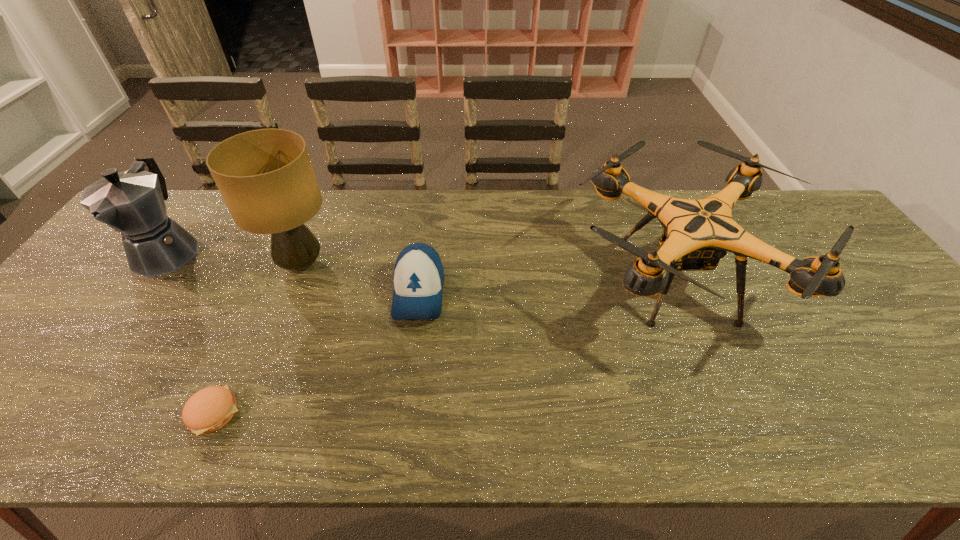
The image size is (960, 540). Identify the location of vacant space located 0.110m on the camera mount of the rightmost object. (528, 280).

The height and width of the screenshot is (540, 960). I want to click on vacant point located on the camera mount of the rightmost object, so click(x=492, y=280).

The image size is (960, 540). I want to click on free point located 0.260m on the front-facing side of the second object from right to left, so click(x=401, y=430).

Where is `free space located on the right of the shortest object`? free space located on the right of the shortest object is located at coordinates (314, 413).

You are a GUI agent. You are given a task and a screenshot of the screen. Output one action in this format:
    pyautogui.click(x=<x>, y=<y>)
    Task: Click on the coffeepot that is at the far edge
    
    Given the screenshot: What is the action you would take?
    pyautogui.click(x=132, y=203)

Locate an element on the screen. This screenshot has width=960, height=540. drone that is at the far edge is located at coordinates (697, 233).

I want to click on object that is at the near edge, so click(208, 410).

You are a GUI agent. You are given a task and a screenshot of the screen. Output one action in this format:
    pyautogui.click(x=<x>, y=<y>)
    Task: Click on the object located at the left edge
    This screenshot has width=960, height=540.
    Given the screenshot: What is the action you would take?
    pyautogui.click(x=132, y=203)

Identify the location of object positioned at the far left corner. pyautogui.click(x=132, y=203).

Find the location of `free space at the near edge of the desktop`. free space at the near edge of the desktop is located at coordinates (815, 424).